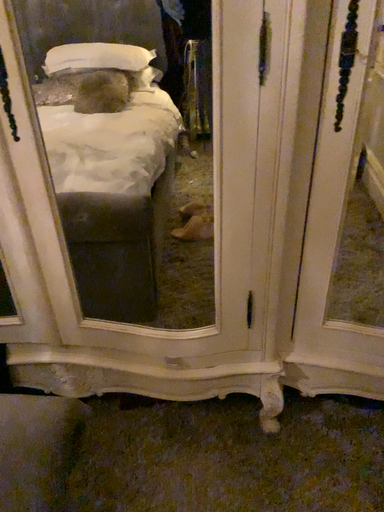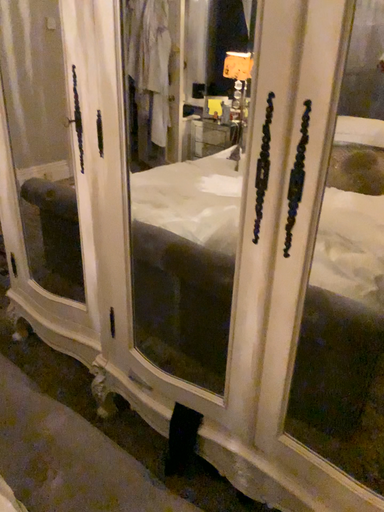
Question: Which way did the camera rotate in the video?

Choices:
 (A) rotated downward
 (B) rotated upward

Answer: (B)